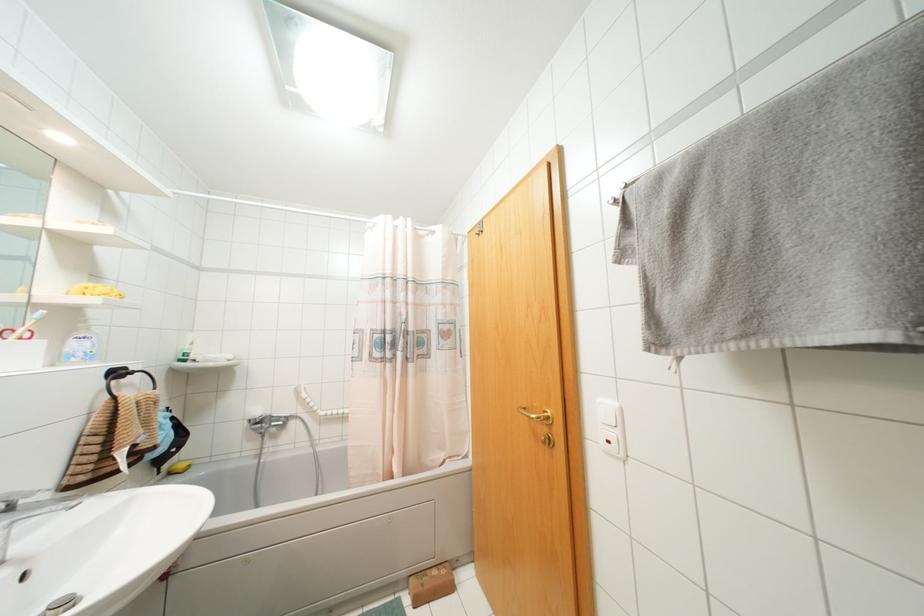
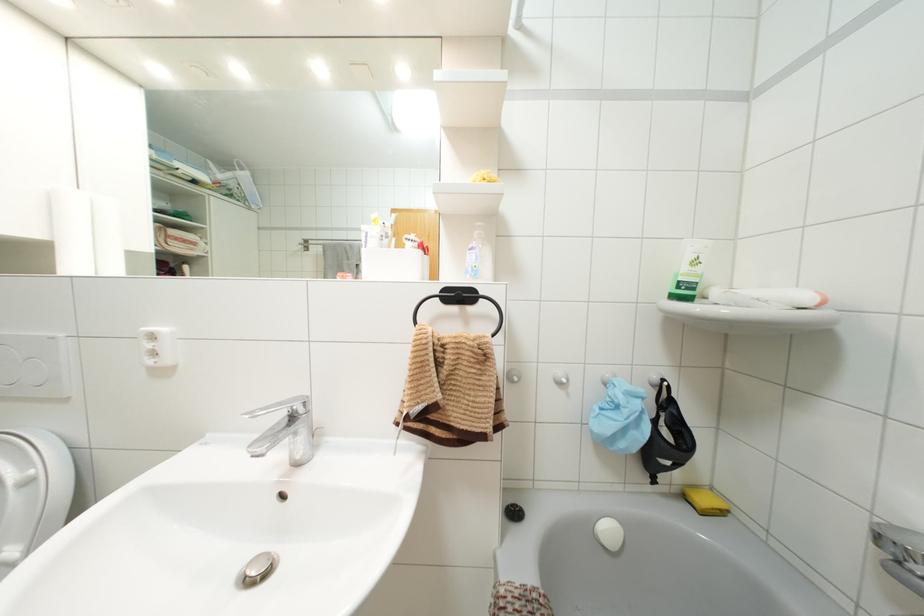
In the second image, find the point that corresponds to (169,472) in the first image.

(685, 496)